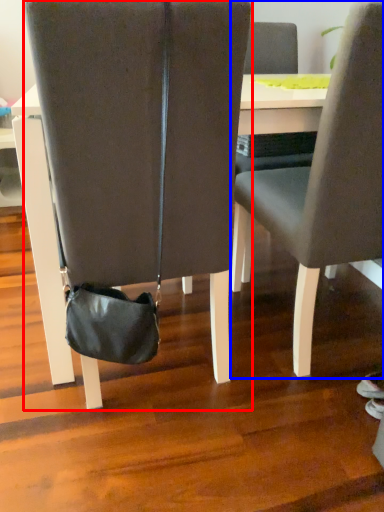
Question: Among these objects, which one is farthest to the camera, chair (highlighted by a red box) or chair (highlighted by a blue box)?

Choices:
 (A) chair
 (B) chair

Answer: (B)